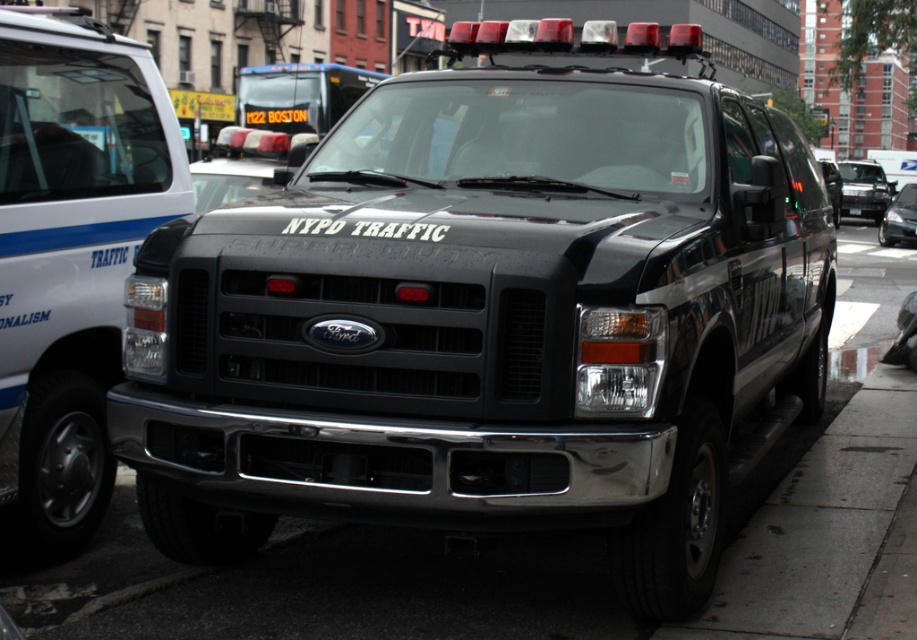
Question: Which of the following is the closest to the observer?

Choices:
 (A) (849, 211)
 (B) (852, 204)
 (C) (893, 214)

Answer: (C)

Question: Can you confirm if black glossy suv at center is positioned to the right of shiny black sedan at center?

Choices:
 (A) no
 (B) yes

Answer: (B)

Question: Does white glossy van at left come in front of shiny black sedan at center?

Choices:
 (A) yes
 (B) no

Answer: (A)

Question: Which point is farther to the camera?

Choices:
 (A) (858, 209)
 (B) (914, 193)
 (C) (853, 188)

Answer: (C)

Question: Can you confirm if white glossy van at left is positioned above black glossy suv at center?

Choices:
 (A) yes
 (B) no

Answer: (B)

Question: Which of the following is the closest to the observer?

Choices:
 (A) black plastic license plate at center
 (B) shiny black sedan at center
 (C) white glossy van at left
 (D) black glossy suv at center

Answer: (C)